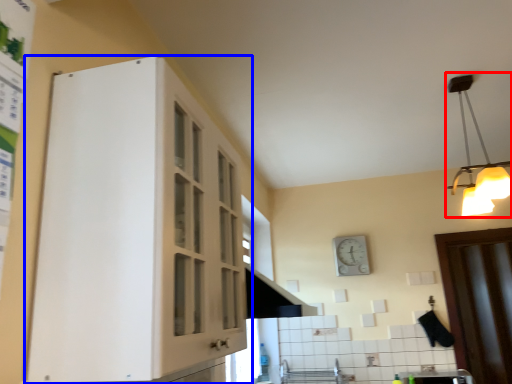
Question: Which point is further to the camera, light fixture (highlighted by a red box) or cabinetry (highlighted by a blue box)?

Choices:
 (A) light fixture
 (B) cabinetry

Answer: (A)